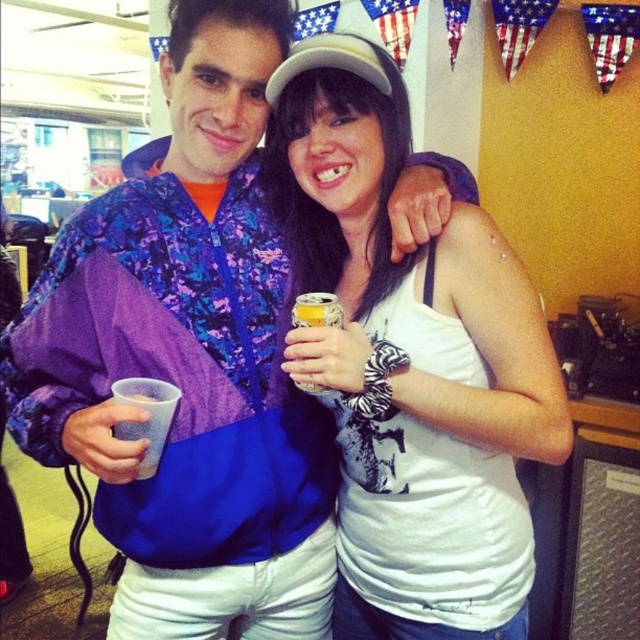
Question: Considering the relative positions of white matte tank top at center and white plastic cup at left in the image provided, where is white matte tank top at center located with respect to white plastic cup at left?

Choices:
 (A) right
 (B) left

Answer: (A)

Question: Which is farther from the white plastic cup at left?

Choices:
 (A) brushed metal cup at upper left
 (B) yellow metallic can at center
 (C) white matte tank top at center

Answer: (C)

Question: Is brushed metal cup at upper left closer to camera compared to white matte tank top at center?

Choices:
 (A) yes
 (B) no

Answer: (A)

Question: Which object is the farthest from the yellow metallic can at center?

Choices:
 (A) white plastic cup at left
 (B) white matte tank top at center

Answer: (B)

Question: Which object is the farthest from the white plastic cup at left?

Choices:
 (A) yellow metallic can at center
 (B) white matte tank top at center
 (C) brushed metal cup at upper left

Answer: (B)

Question: Does white matte tank top at center appear on the right side of yellow metallic can at center?

Choices:
 (A) yes
 (B) no

Answer: (A)